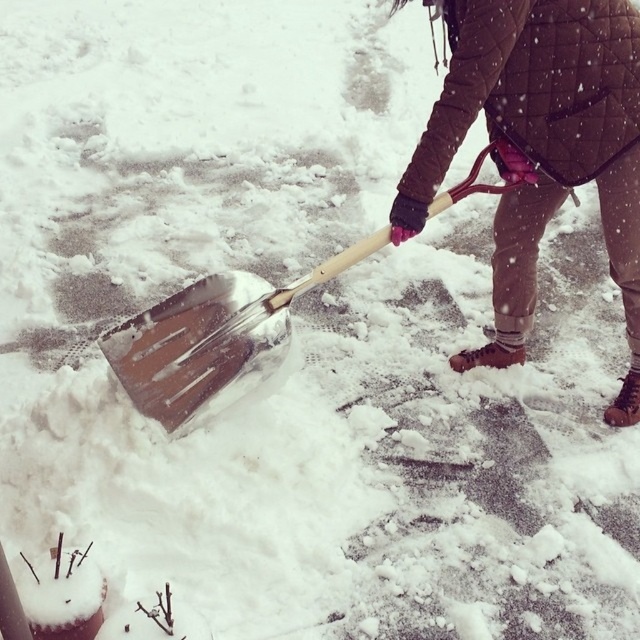
Between brown quilted jacket at upper center and brushed metal shovel at center, which one appears on the left side from the viewer's perspective?

brushed metal shovel at center is more to the left.

Which is in front, point (637, 173) or point (493, 188)?

Point (493, 188) is in front.

I want to click on brown quilted jacket at upper center, so click(540, 148).

The height and width of the screenshot is (640, 640). What are the coordinates of `brown quilted jacket at upper center` in the screenshot? It's located at (540, 148).